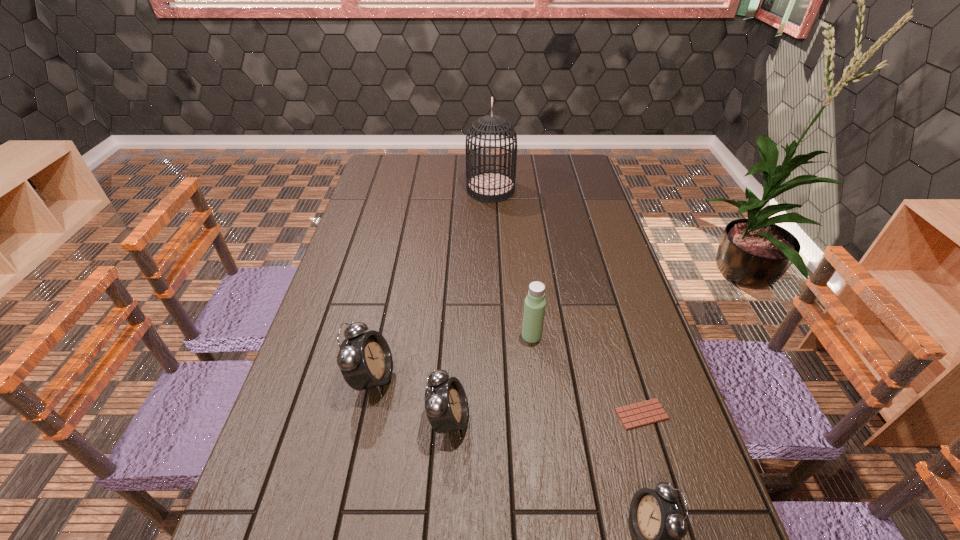
Where is `the leftmost alarm clock`? the leftmost alarm clock is located at coordinates (365, 360).

At what (x,y) coordinates should I click in order to perform the action: click on the fourth tallest object. Please return your answer as a coordinate pair (x, y). This screenshot has width=960, height=540. Looking at the image, I should click on (446, 405).

Find the location of a particular element. the second shortest alarm clock is located at coordinates (446, 405).

Where is `birdcage`? This screenshot has width=960, height=540. birdcage is located at coordinates (489, 186).

At what (x,y) coordinates should I click in order to perform the action: click on the tallest object. Please return your answer as a coordinate pair (x, y). Looking at the image, I should click on (489, 186).

Where is `candy bar`? The height and width of the screenshot is (540, 960). candy bar is located at coordinates (636, 415).

You are a GUI agent. You are given a task and a screenshot of the screen. Output one action in this format:
    pyautogui.click(x=<x>, y=<y>)
    Task: Click on the thermos bottle
    Image resolution: width=960 pixels, height=540 pixels.
    Given the screenshot: What is the action you would take?
    pyautogui.click(x=534, y=308)

The height and width of the screenshot is (540, 960). Identify the location of free location located on the face of the leftmost alarm clock. (439, 379).

The width and height of the screenshot is (960, 540). I want to click on vacant region located 0.240m on the face of the second shortest alarm clock, so click(575, 420).

I want to click on free space located 0.060m on the right of the birdcage, so click(x=530, y=190).